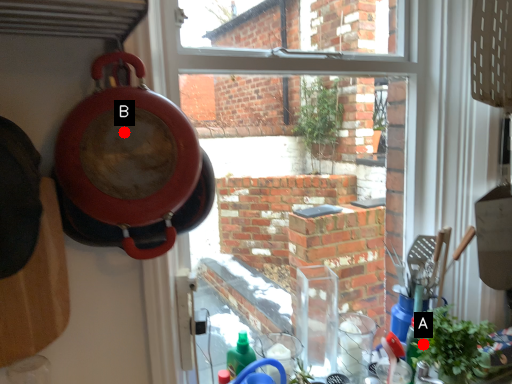
Question: Two points are circled on the image, labeled by A and B beside each circle. Which of the following is the closest to the observer?

Choices:
 (A) A is closer
 (B) B is closer

Answer: (B)